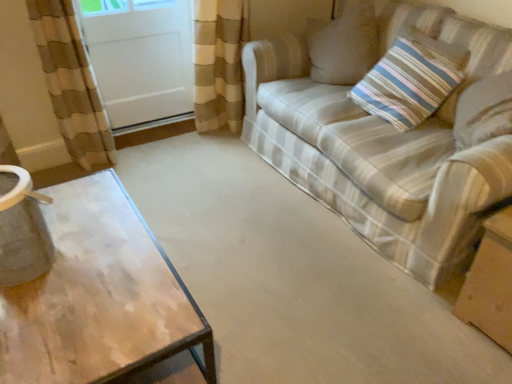
Where is `vacant space to the right of white glossy screen door at upper left`? Image resolution: width=512 pixels, height=384 pixels. vacant space to the right of white glossy screen door at upper left is located at coordinates (210, 145).